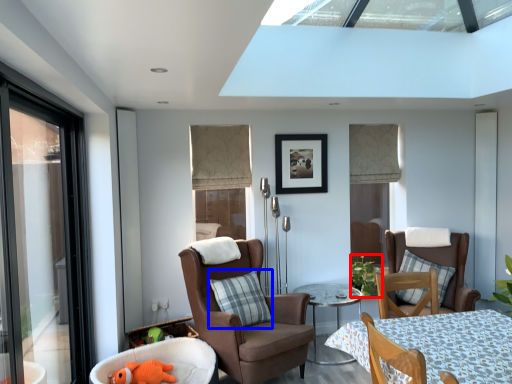
Question: Which of the following is the closest to the observer, plant (highlighted by a red box) or pillow (highlighted by a blue box)?

Choices:
 (A) plant
 (B) pillow

Answer: (B)